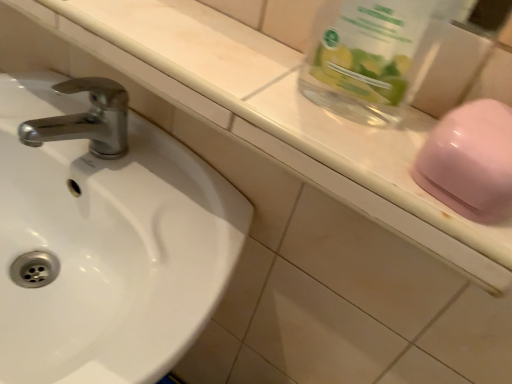
Question: Does glossy plastic soap at right lie behind white glossy sink at left?

Choices:
 (A) no
 (B) yes

Answer: (A)

Question: From the image's perspective, is glossy plastic soap at right located beneath white glossy sink at left?

Choices:
 (A) yes
 (B) no

Answer: (B)

Question: Is glossy plastic soap at right positioned beyond the bounds of white glossy sink at left?

Choices:
 (A) yes
 (B) no

Answer: (A)

Question: Is white glossy sink at left surrounded by glossy plastic soap at right?

Choices:
 (A) no
 (B) yes

Answer: (A)

Question: Can you confirm if glossy plastic soap at right is wider than white glossy sink at left?

Choices:
 (A) yes
 (B) no

Answer: (B)

Question: Is glossy plastic soap at right oriented towards white glossy sink at left?

Choices:
 (A) yes
 (B) no

Answer: (B)

Question: From a real-world perspective, is glossy plastic soap at right located beneath transparent glass jar at upper right?

Choices:
 (A) no
 (B) yes

Answer: (B)

Question: Considering the relative sizes of glossy plastic soap at right and transparent glass jar at upper right in the image provided, is glossy plastic soap at right thinner than transparent glass jar at upper right?

Choices:
 (A) no
 (B) yes

Answer: (A)

Question: Is glossy plastic soap at right with transparent glass jar at upper right?

Choices:
 (A) no
 (B) yes

Answer: (B)

Question: Is glossy plastic soap at right positioned with its back to transparent glass jar at upper right?

Choices:
 (A) yes
 (B) no

Answer: (B)

Question: Is glossy plastic soap at right to the left of transparent glass jar at upper right from the viewer's perspective?

Choices:
 (A) yes
 (B) no

Answer: (B)

Question: Is glossy plastic soap at right completely or partially outside of transparent glass jar at upper right?

Choices:
 (A) yes
 (B) no

Answer: (A)

Question: Is transparent glass jar at upper right positioned behind white glossy sink at left?

Choices:
 (A) no
 (B) yes

Answer: (A)